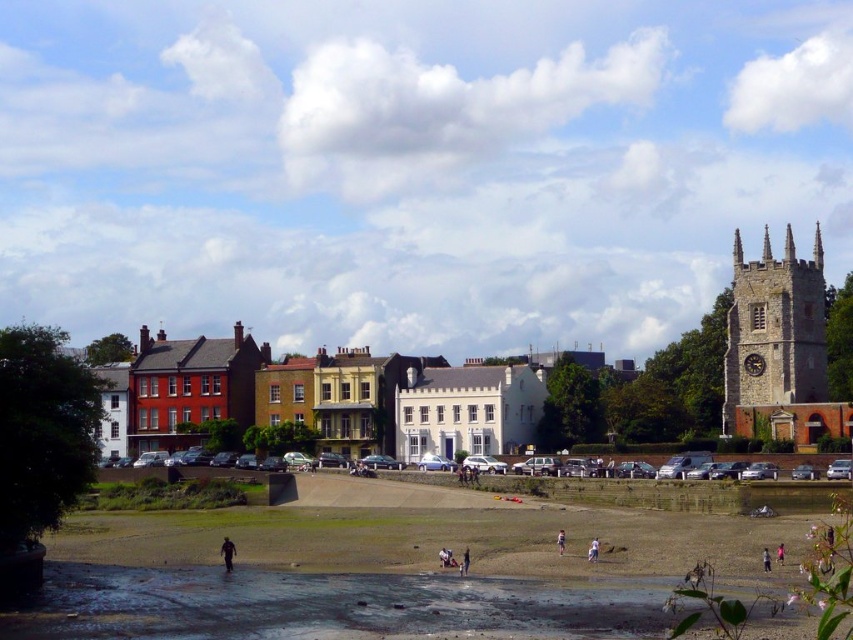
You are a photographer standing at the riverside and notice two features in the lower center area of your viewfinder. One is the dark brown leather jacket at lower center and the other is the light brown hair at lower center. Which of these two features appears taller in the scene?

The dark brown leather jacket at lower center appears taller than the light brown hair at lower center in the scene.

You are observing a riverside scene. There is a dark brown leather jacket at lower center and a light brown hair at lower center. Which object is closer to the observer?

The dark brown leather jacket at lower center is closer to the observer because the light brown hair at lower center is behind it.